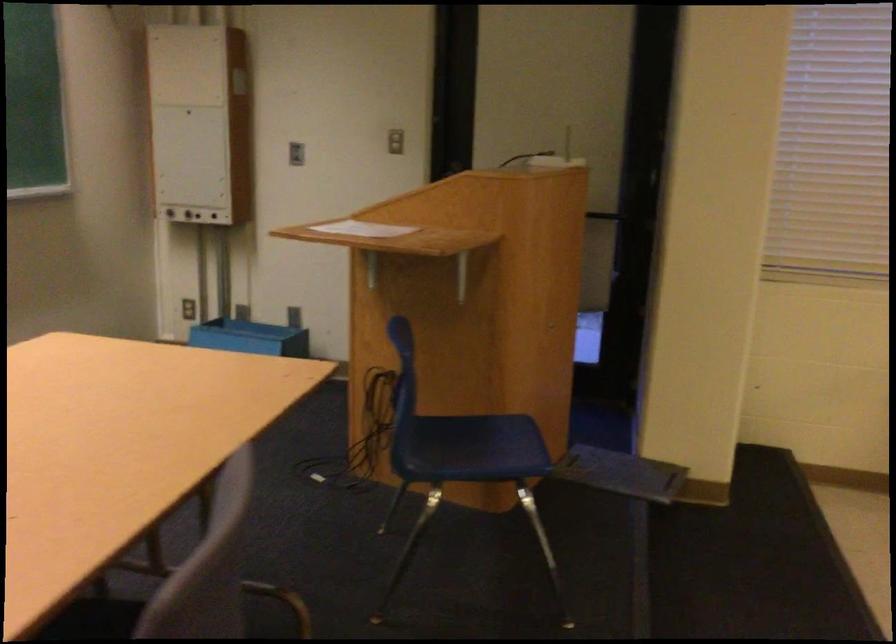
Locate an element on the screen. This screenshot has width=896, height=644. control panel knob is located at coordinates (167, 210).